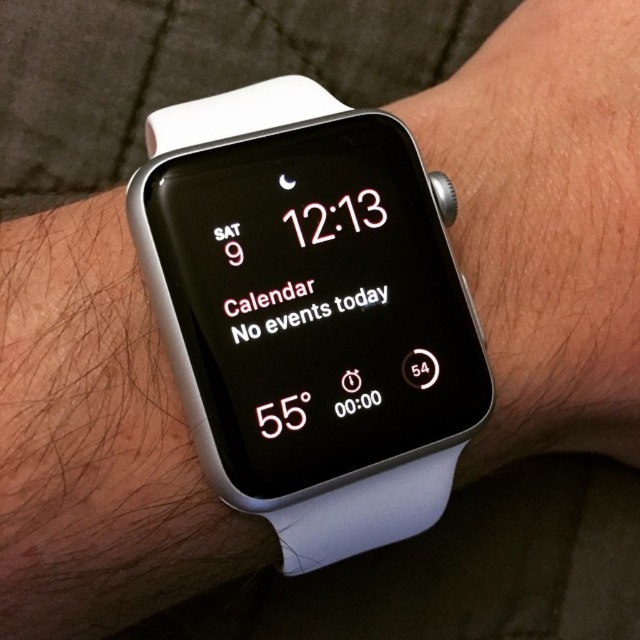
Question: Does white plastic watch at center appear under white rubber watch at center?

Choices:
 (A) yes
 (B) no

Answer: (A)

Question: Which point is closer to the camera?

Choices:
 (A) (378, 468)
 (B) (570, 150)

Answer: (A)

Question: Among these points, which one is farthest from the camera?

Choices:
 (A) (307, 269)
 (B) (595, 266)

Answer: (B)

Question: Is white plastic watch at center wider than white rubber watch at center?

Choices:
 (A) no
 (B) yes

Answer: (A)

Question: Does white plastic watch at center have a smaller size compared to white rubber watch at center?

Choices:
 (A) yes
 (B) no

Answer: (A)